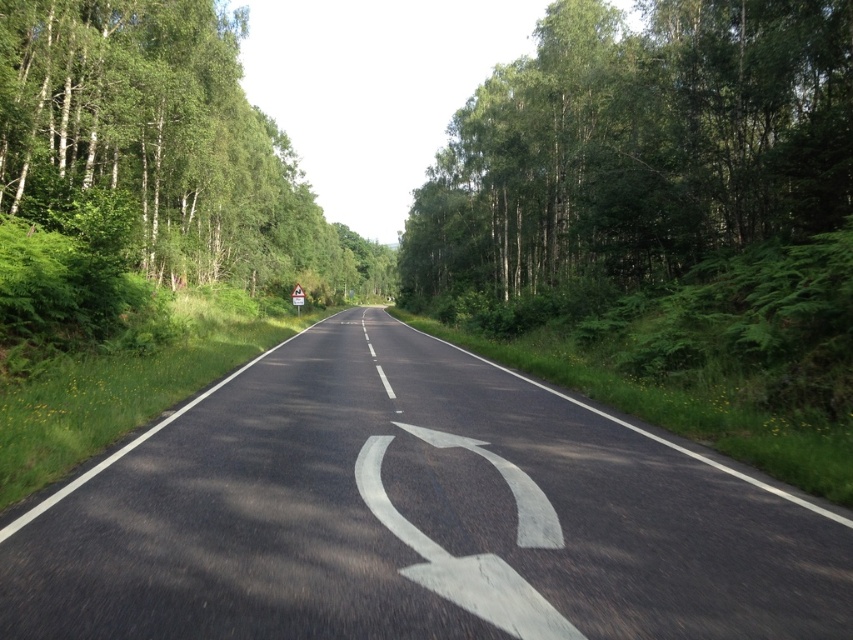
Can you confirm if green leafy trees at right is positioned to the right of white asphalt curve at center?

Yes, green leafy trees at right is to the right of white asphalt curve at center.

Between point (822, 24) and point (527, 595), which one is positioned behind?

Point (822, 24)

The height and width of the screenshot is (640, 853). I want to click on green leafy trees at right, so click(637, 148).

Does black asphalt road at center come behind green leafy trees at left?

No, it is not.

Can you confirm if black asphalt road at center is positioned to the right of green leafy trees at left?

Correct, you'll find black asphalt road at center to the right of green leafy trees at left.

Who is more distant from viewer, (265, 614) or (192, 252)?

The point (192, 252) is more distant.

This screenshot has height=640, width=853. Identify the location of black asphalt road at center. (415, 515).

Does green leafy trees at left appear under white asphalt curve at center?

No, green leafy trees at left is not below white asphalt curve at center.

Measure the distance from green leafy trees at left to white asphalt curve at center.

green leafy trees at left is 99.00 meters from white asphalt curve at center.

Where is `green leafy trees at left`? The width and height of the screenshot is (853, 640). green leafy trees at left is located at coordinates (164, 144).